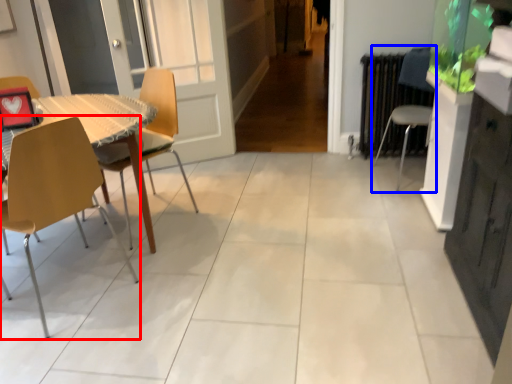
Question: Which object appears closest to the camera in this image, chair (highlighted by a red box) or chair (highlighted by a blue box)?

Choices:
 (A) chair
 (B) chair

Answer: (A)